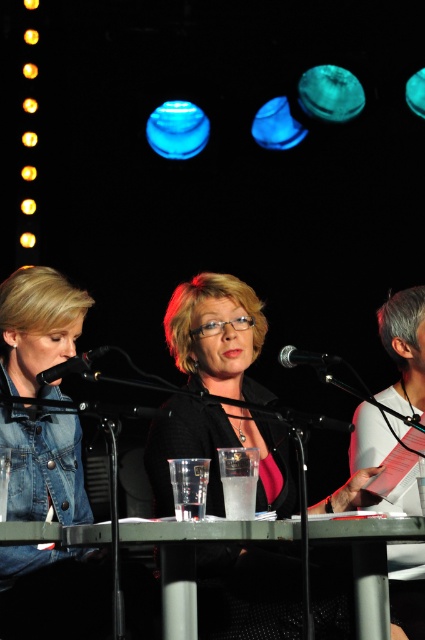
Can you confirm if black matte microphone at left is bigger than black metallic microphone at center?

Indeed, black matte microphone at left has a larger size compared to black metallic microphone at center.

Image resolution: width=425 pixels, height=640 pixels. Find the location of `black matte microphone at left`. black matte microphone at left is located at coordinates (71, 365).

Find the location of a particular element. This screenshot has height=640, width=425. black matte microphone at left is located at coordinates (71, 365).

From the picture: Does metallic gray table at center appear on the left side of white paper at right?

Correct, you'll find metallic gray table at center to the left of white paper at right.

Does point (371, 589) come behind point (399, 294)?

No.

Which is in front, point (181, 532) or point (422, 616)?

Point (181, 532)

At what (x,y) coordinates should I click in order to perform the action: click on metallic gray table at center. Please return your answer as a coordinate pair (x, y). This screenshot has width=425, height=640. Looking at the image, I should click on (193, 560).

Between metallic gray table at center and black matte microphone at left, which one is positioned higher?

black matte microphone at left is above.

Who is more distant from viewer, [192,545] or [107,348]?

The point [192,545] is more distant.

Is point (373, 532) closer to camera compared to point (65, 365)?

Yes, it is.

Find the location of a particular element. metallic gray table at center is located at coordinates (193, 560).